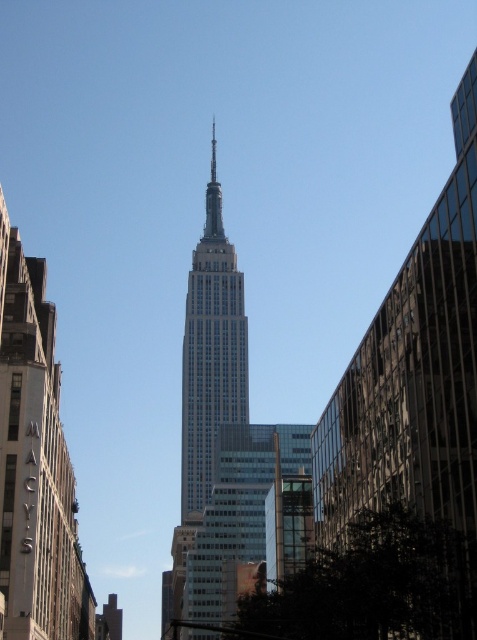
Question: Observing the image, what is the correct spatial positioning of glassy reflective skyscraper at center in reference to white glass building at center?

Choices:
 (A) left
 (B) right

Answer: (B)

Question: Estimate the real-world distances between objects in this image. Which object is closer to the white glass building at center?

Choices:
 (A) matte glass skyscraper at center
 (B) glassy reflective skyscraper at center

Answer: (A)

Question: Based on their relative distances, which object is farther from the glassy reflective skyscraper at center?

Choices:
 (A) matte glass skyscraper at center
 (B) white glass building at center

Answer: (B)

Question: Can you confirm if glassy reflective skyscraper at center is positioned above matte glass skyscraper at center?

Choices:
 (A) no
 (B) yes

Answer: (B)

Question: Based on their relative distances, which object is nearer to the white glass building at center?

Choices:
 (A) glassy reflective skyscraper at center
 (B) matte glass skyscraper at center

Answer: (B)

Question: Can you confirm if glassy reflective skyscraper at center is wider than white glass building at center?

Choices:
 (A) no
 (B) yes

Answer: (A)